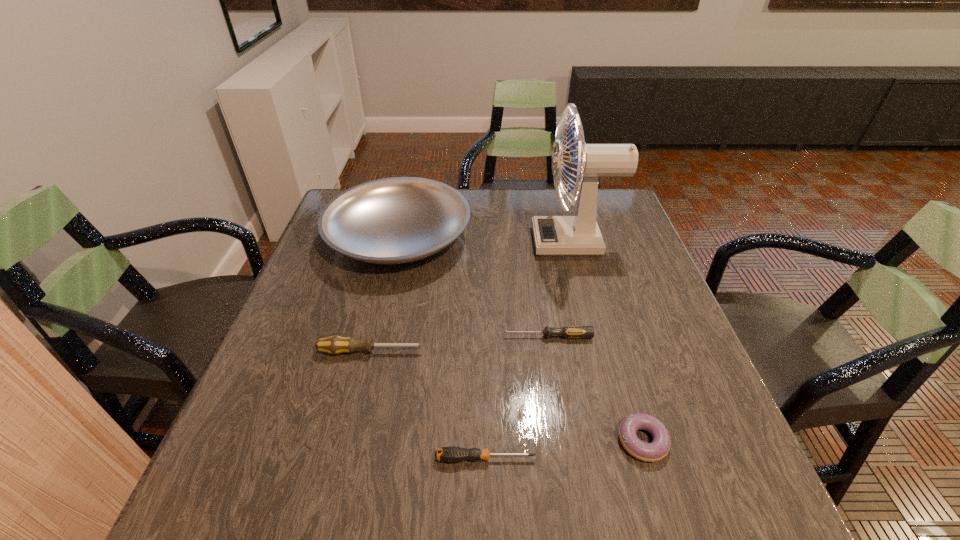
This screenshot has width=960, height=540. In order to click on the tallest object in this screenshot , I will do `click(579, 235)`.

I want to click on the second tallest object, so click(x=396, y=220).

The width and height of the screenshot is (960, 540). I want to click on the fourth farthest object, so click(334, 345).

Where is `the tallest screwdriver`? the tallest screwdriver is located at coordinates tap(334, 345).

The width and height of the screenshot is (960, 540). In order to click on doughnut in this screenshot , I will do `click(656, 450)`.

The height and width of the screenshot is (540, 960). I want to click on the fourth nearest object, so click(567, 331).

Find the location of `the nearest screwdriver`. the nearest screwdriver is located at coordinates (452, 454).

The image size is (960, 540). Identify the location of vacant space located on the front-facing side of the tallest object. (420, 241).

This screenshot has height=540, width=960. I want to click on free location located on the front-facing side of the tallest object, so click(469, 241).

Locate an element on the screen. This screenshot has height=540, width=960. free point located 0.250m on the front-facing side of the tallest object is located at coordinates (444, 241).